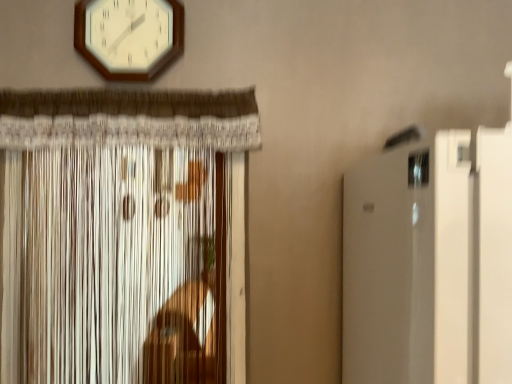
Locate an element on the screen. The image size is (512, 384). white textured curtain at left is located at coordinates (124, 236).

Image resolution: width=512 pixels, height=384 pixels. Describe the element at coordinates (124, 236) in the screenshot. I see `white textured curtain at left` at that location.

Locate an element on the screen. This screenshot has height=384, width=512. white wooden wall clock at upper center is located at coordinates (129, 36).

The height and width of the screenshot is (384, 512). What do you see at coordinates (129, 36) in the screenshot?
I see `white wooden wall clock at upper center` at bounding box center [129, 36].

Locate an element on the screen. white textured curtain at left is located at coordinates 124,236.

Is white wooden wall clock at upper center at the right side of white textured curtain at left?

Correct, you'll find white wooden wall clock at upper center to the right of white textured curtain at left.

Which object is more forward, white wooden wall clock at upper center or white textured curtain at left?

white textured curtain at left is in front.

Which is in front, point (108, 69) or point (65, 248)?

Positioned in front is point (108, 69).

From the image's perspective, relative to white textured curtain at left, is white wooden wall clock at upper center above or below?

white wooden wall clock at upper center is above white textured curtain at left.

From a real-world perspective, is white wooden wall clock at upper center positioned over white textured curtain at left based on gravity?

Yes, from a real-world perspective, white wooden wall clock at upper center is above white textured curtain at left.

Is white wooden wall clock at upper center thinner than white textured curtain at left?

Indeed, white wooden wall clock at upper center has a lesser width compared to white textured curtain at left.

Can you confirm if white wooden wall clock at upper center is taller than white textured curtain at left?

In fact, white wooden wall clock at upper center may be shorter than white textured curtain at left.

Considering the sizes of white wooden wall clock at upper center and white textured curtain at left in the image, is white wooden wall clock at upper center bigger or smaller than white textured curtain at left?

In the image, white wooden wall clock at upper center appears to be smaller than white textured curtain at left.

Do you think white wooden wall clock at upper center is within white textured curtain at left, or outside of it?

white wooden wall clock at upper center is not inside white textured curtain at left, it's outside.

Does white wooden wall clock at upper center touch white textured curtain at left?

No, white wooden wall clock at upper center is not beside white textured curtain at left.

Is white wooden wall clock at upper center facing towards white textured curtain at left?

No, white wooden wall clock at upper center is not aimed at white textured curtain at left.

Can you tell me how much white wooden wall clock at upper center and white textured curtain at left differ in facing direction?

0.000485 degrees.

Image resolution: width=512 pixels, height=384 pixels. Find the location of `wall clock located on the right of white textured curtain at left`. wall clock located on the right of white textured curtain at left is located at coordinates (129, 36).

Between white textured curtain at left and white wooden wall clock at upper center, which one appears on the left side from the viewer's perspective?

Positioned to the left is white textured curtain at left.

Does white textured curtain at left lie in front of white wooden wall clock at upper center?

Yes, the depth of white textured curtain at left is less than that of white wooden wall clock at upper center.

Does point (129, 165) come closer to viewer compared to point (155, 22)?

No, (129, 165) is behind (155, 22).

From the image's perspective, between white textured curtain at left and white wooden wall clock at upper center, who is located below?

white textured curtain at left is shown below in the image.

From a real-world perspective, is white textured curtain at left beneath white wooden wall clock at upper center?

Indeed, from a real-world perspective, white textured curtain at left is positioned beneath white wooden wall clock at upper center.

Does white textured curtain at left have a greater width compared to white wooden wall clock at upper center?

Yes.

Can you confirm if white textured curtain at left is taller than white wooden wall clock at upper center?

Indeed, white textured curtain at left has a greater height compared to white wooden wall clock at upper center.

Who is bigger, white textured curtain at left or white wooden wall clock at upper center?

white textured curtain at left is bigger.

Is white textured curtain at left completely or partially outside of white wooden wall clock at upper center?

Yes, white textured curtain at left is outside of white wooden wall clock at upper center.

Is white textured curtain at left next to white wooden wall clock at upper center?

No, white textured curtain at left is not beside white wooden wall clock at upper center.

Does white textured curtain at left turn towards white wooden wall clock at upper center?

No.

Measure the distance from white textured curtain at left to white wooden wall clock at upper center.

The distance of white textured curtain at left from white wooden wall clock at upper center is 38.43 centimeters.

Where is `curtain lying below the white wooden wall clock at upper center (from the image's perspective)`? This screenshot has width=512, height=384. curtain lying below the white wooden wall clock at upper center (from the image's perspective) is located at coordinates (124, 236).

Identify the location of curtain below the white wooden wall clock at upper center (from the image's perspective). (124, 236).

Find the location of a particular element. curtain that appears below the white wooden wall clock at upper center (from a real-world perspective) is located at coordinates (124, 236).